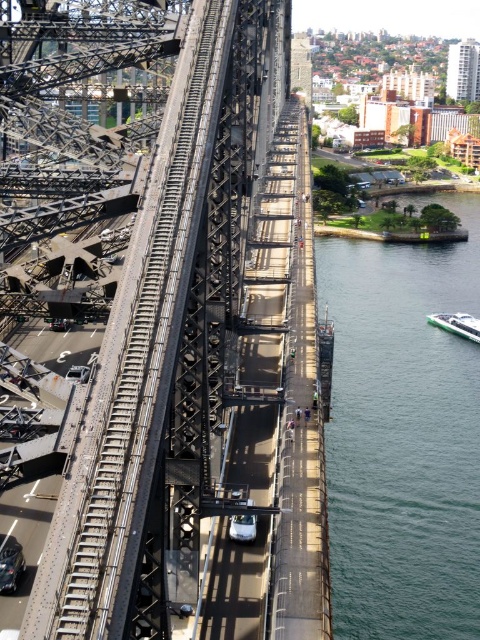
Question: Is green water at lower right positioned in front of white glossy boat at lower right?

Choices:
 (A) no
 (B) yes

Answer: (B)

Question: Considering the relative positions of green water at lower right and white glossy boat at lower right in the image provided, where is green water at lower right located with respect to white glossy boat at lower right?

Choices:
 (A) below
 (B) above

Answer: (A)

Question: Which object appears farthest from the camera in this image?

Choices:
 (A) white glossy boat at lower right
 (B) black steel bridge at center
 (C) green water at lower right

Answer: (A)

Question: Where is green water at lower right located in relation to white glossy boat at lower right in the image?

Choices:
 (A) below
 (B) above

Answer: (A)

Question: Based on their relative distances, which object is farther from the green water at lower right?

Choices:
 (A) white glossy boat at lower right
 (B) black steel bridge at center

Answer: (B)

Question: Which point is closer to the camera?

Choices:
 (A) green water at lower right
 (B) black steel bridge at center

Answer: (B)